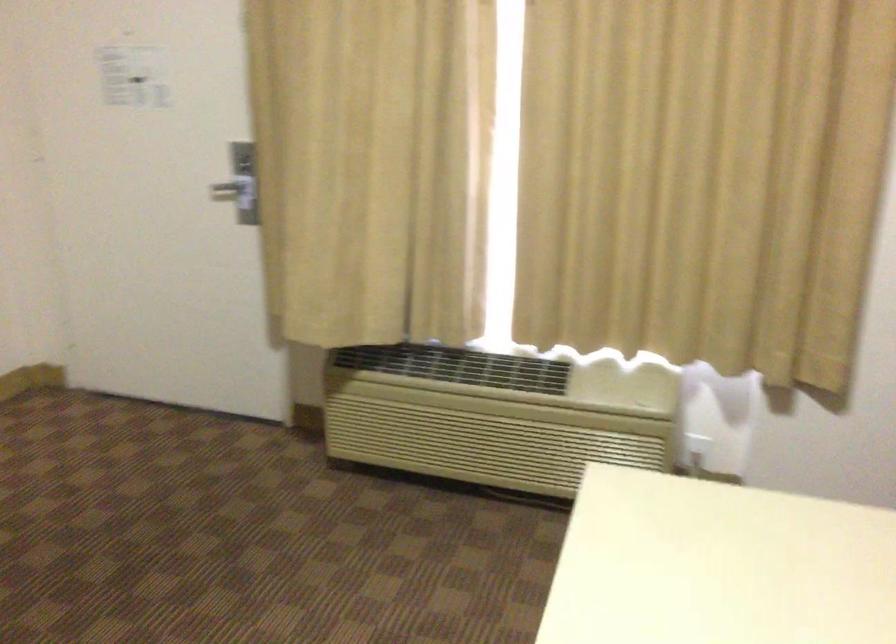
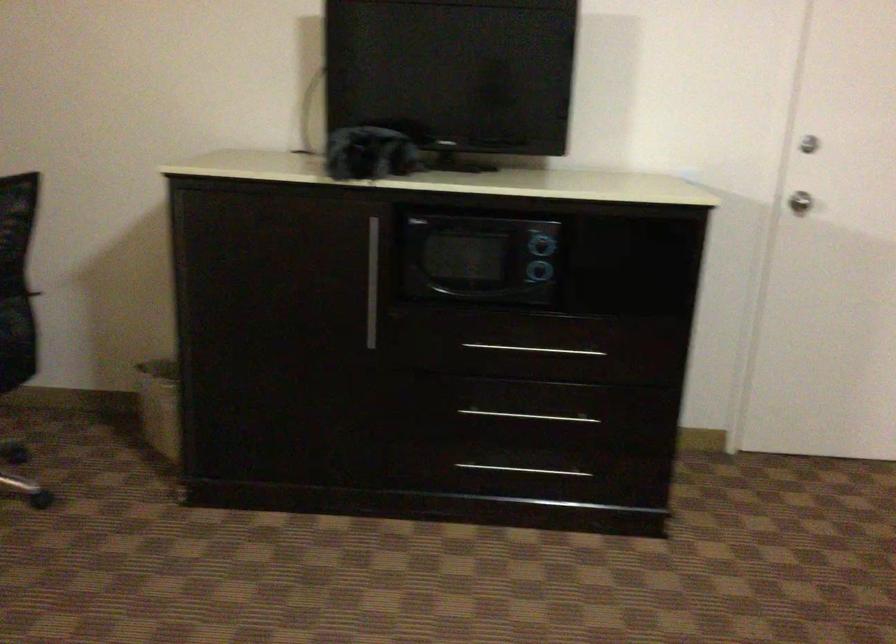
Question: The camera is either moving clockwise (left) or counter-clockwise (right) around the object. The first image is from the beginning of the video and the second image is from the end. Is the camera moving left or right when shooting the video?

Choices:
 (A) Left
 (B) Right

Answer: (B)